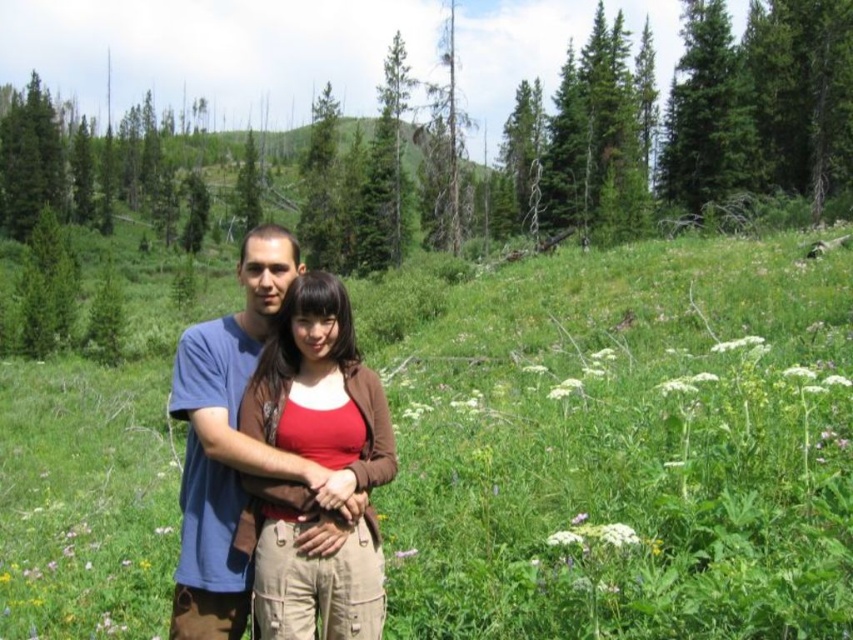
Question: Does green grassy field at center have a greater width compared to white fluffy flower at lower right?

Choices:
 (A) no
 (B) yes

Answer: (B)

Question: Which object is positioned farthest from the white soft flower at center-right?

Choices:
 (A) brown cotton shirt at center
 (B) green leafy plant at center
 (C) white fluffy flower at right
 (D) green grassy field at center

Answer: (D)

Question: Which point is farther from the camera taking this photo?

Choices:
 (A) (434, 445)
 (B) (711, 374)
 (C) (602, 531)

Answer: (A)

Question: Which object is farther from the camera taking this photo?

Choices:
 (A) white fluffy flower at right
 (B) white fluffy flower at center-right

Answer: (B)

Question: Is white soft flower at center-right above white soft flower at center?

Choices:
 (A) yes
 (B) no

Answer: (A)

Question: Is white fluffy flower at lower right positioned before white soft flower at center-right?

Choices:
 (A) no
 (B) yes

Answer: (B)